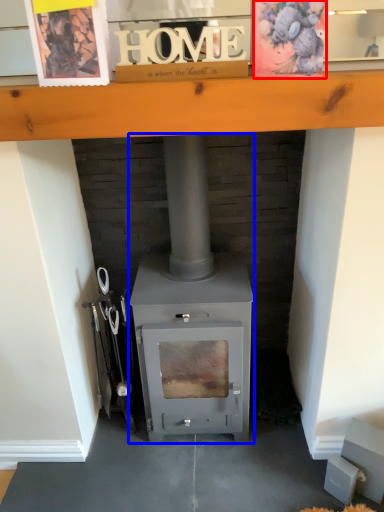
Question: Which object appears closest to the camera in this image, postcard (highlighted by a red box) or wood burning stove (highlighted by a blue box)?

Choices:
 (A) postcard
 (B) wood burning stove

Answer: (A)